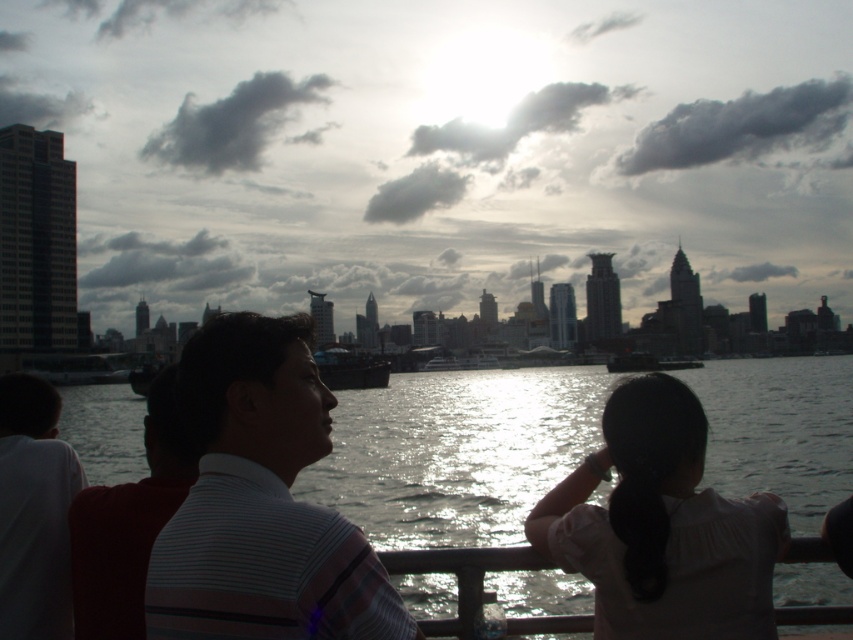
You are a photographer planning to take a photo of the glistening water at center and the white matte shirt at left. Given that your camera has a maximum focus range of 600 feet, will both subjects be in focus simultaneously?

The distance between the glistening water at center and white matte shirt at left is 670.21 feet. Since this exceeds the camera maximum focus range of 600 feet, both subjects cannot be in focus simultaneously.

You are standing at the point with coordinates [456,452] in the riverside scene. What surface are you currently standing on?

The point at coordinates [456,452] is on glistening water at center, so you are standing on glistening water at center.

You are a photographer trying to capture the scene with a wide angle lens. You want to ensure that both the glistening water at center and the striped cotton shirt at center are in focus. Based on their positions, which object should you focus on to ensure both are sharp?

You should focus on the striped cotton shirt at center because it is closer to you than the glistening water at center, which is further away. By focusing on the closer object, the depth of field will extend further back, increasing the chances of both being in focus.